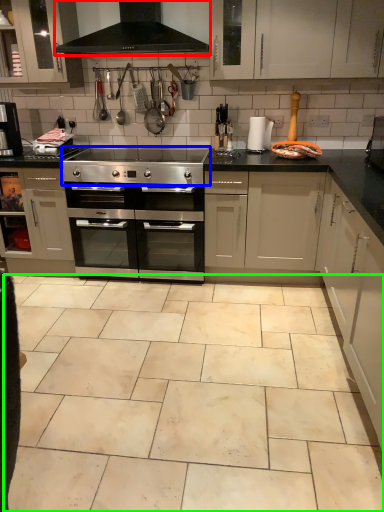
Question: Which is nearer to the exhaust hood (highlighted by a red box)? gas stove (highlighted by a blue box) or ceramic tile (highlighted by a green box).

Choices:
 (A) gas stove
 (B) ceramic tile

Answer: (A)